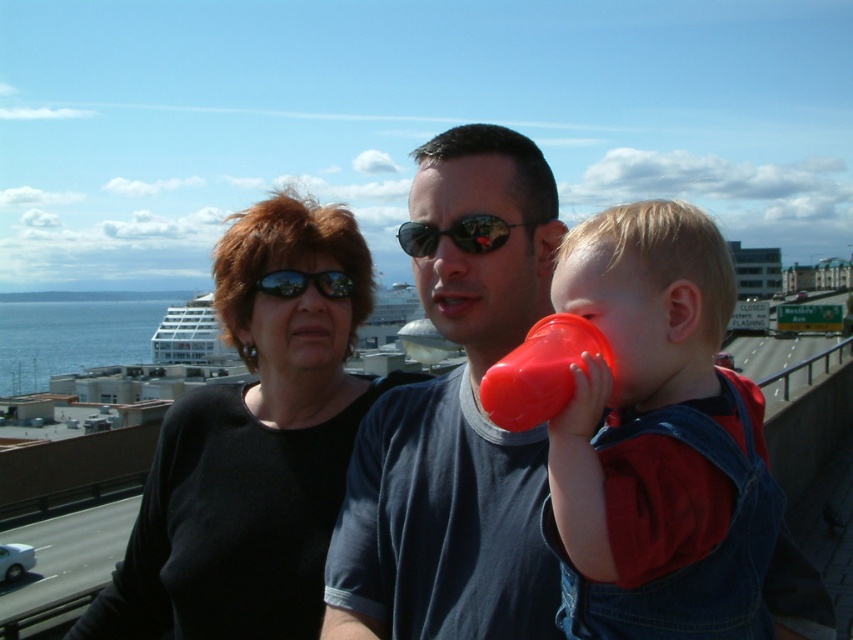
You are a photographer trying to capture a group photo of the matte black shirt at center and the black matte shirt at center. Which one is on the right side when looking at the scene?

The matte black shirt at center is positioned on the right side of the black matte shirt at center.